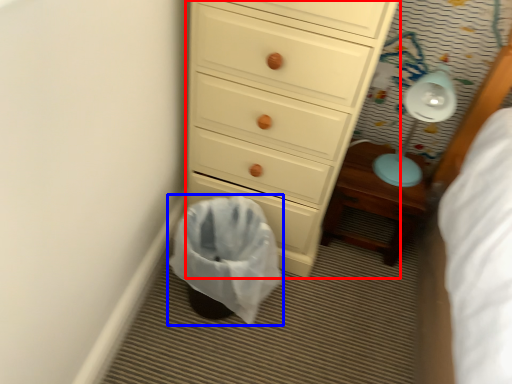
Question: Which object appears closest to the camera in this image, chest of drawers (highlighted by a red box) or laundry basket (highlighted by a blue box)?

Choices:
 (A) chest of drawers
 (B) laundry basket

Answer: (A)